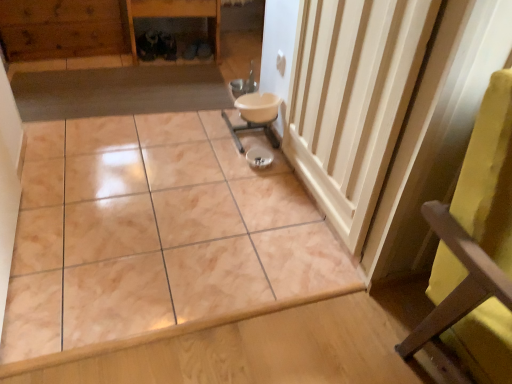
This screenshot has width=512, height=384. I want to click on free space on the front side of white glossy sink at center, so click(x=226, y=168).